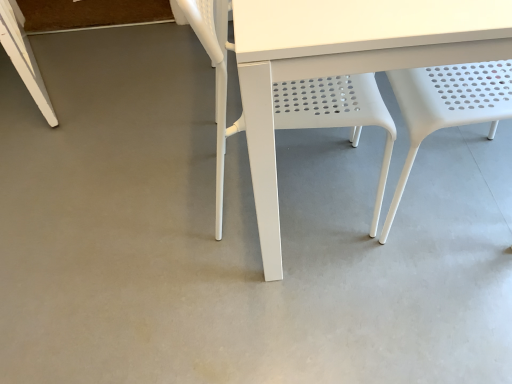
Identify the location of vacant area that lies between white plastic chair at center, placed as the first chair when sorted from left to right, and white perforated plastic chair at center, which is the first chair in right-to-left order. Image resolution: width=512 pixels, height=384 pixels. (352, 210).